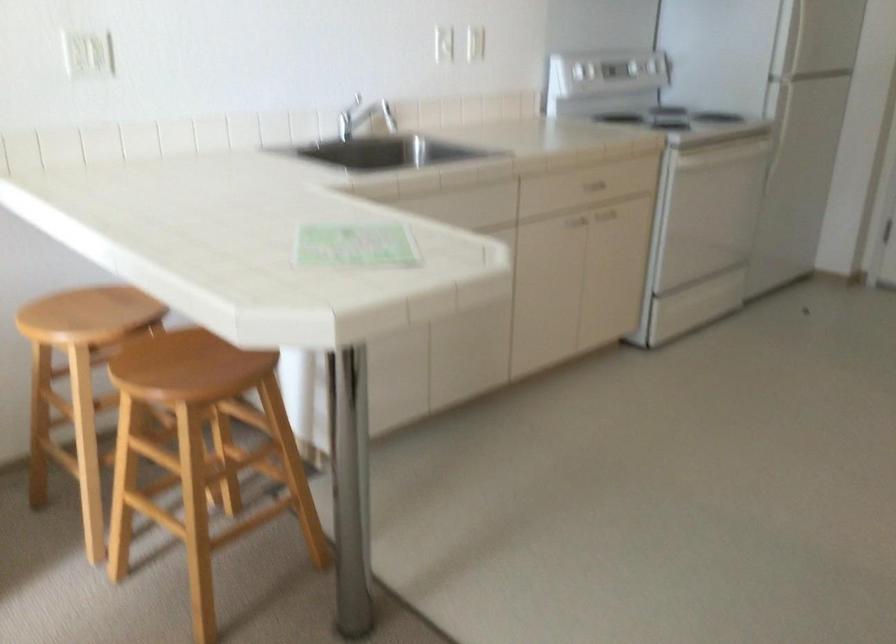
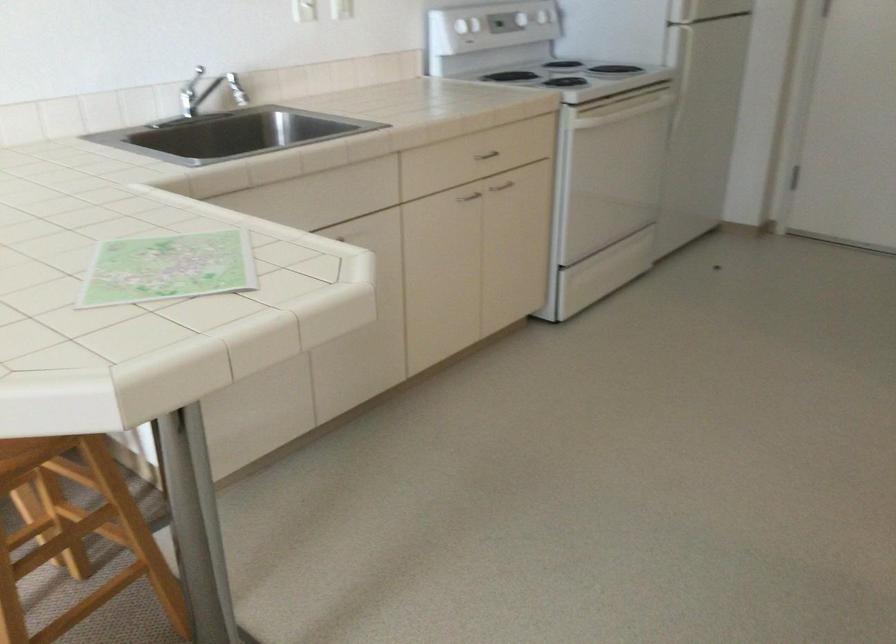
Question: The images are taken continuously from a first-person perspective. In which direction is your viewpoint rotating?

Choices:
 (A) Left
 (B) Right
 (C) Up
 (D) Down

Answer: (B)